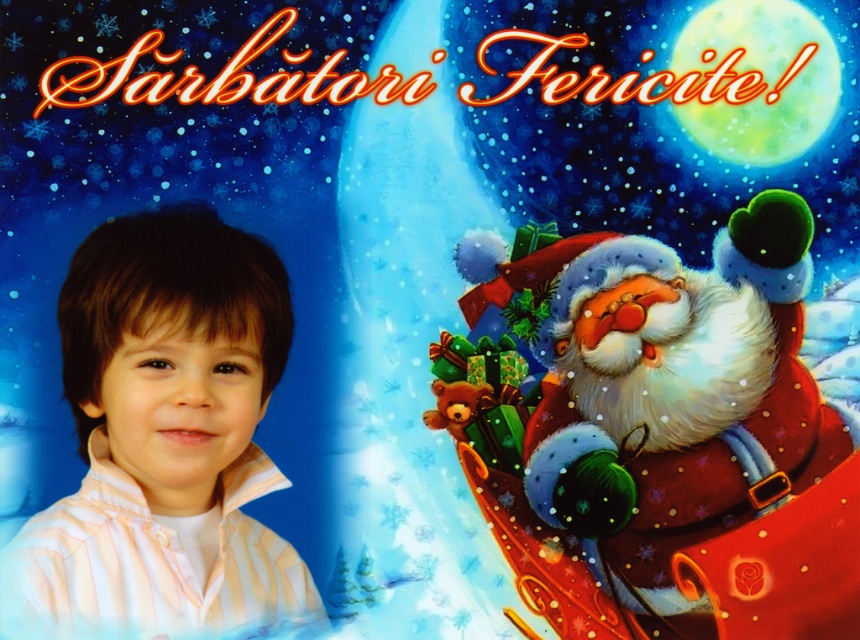
Question: From the image, what is the correct spatial relationship of fuzzy red santa at right in relation to striped cotton shirt at left?

Choices:
 (A) below
 (B) above

Answer: (A)

Question: Is fuzzy red santa at right to the right of striped cotton shirt at left from the viewer's perspective?

Choices:
 (A) yes
 (B) no

Answer: (A)

Question: Which point appears closest to the camera in this image?

Choices:
 (A) (120, 468)
 (B) (736, 426)

Answer: (A)

Question: Which point is farther to the camera?

Choices:
 (A) (820, 532)
 (B) (17, 605)

Answer: (A)

Question: Is fuzzy red santa at right above striped cotton shirt at left?

Choices:
 (A) yes
 (B) no

Answer: (B)